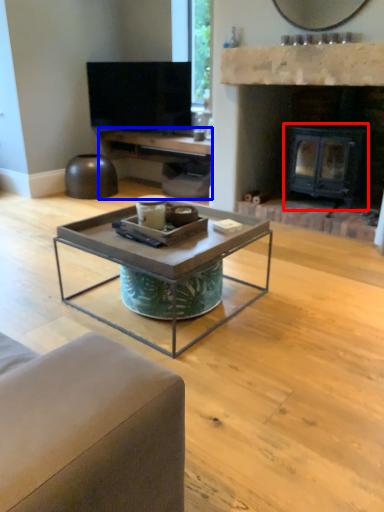
Question: Which point is closer to the camera, fireplace (highlighted by a red box) or entertainment center (highlighted by a blue box)?

Choices:
 (A) fireplace
 (B) entertainment center

Answer: (A)